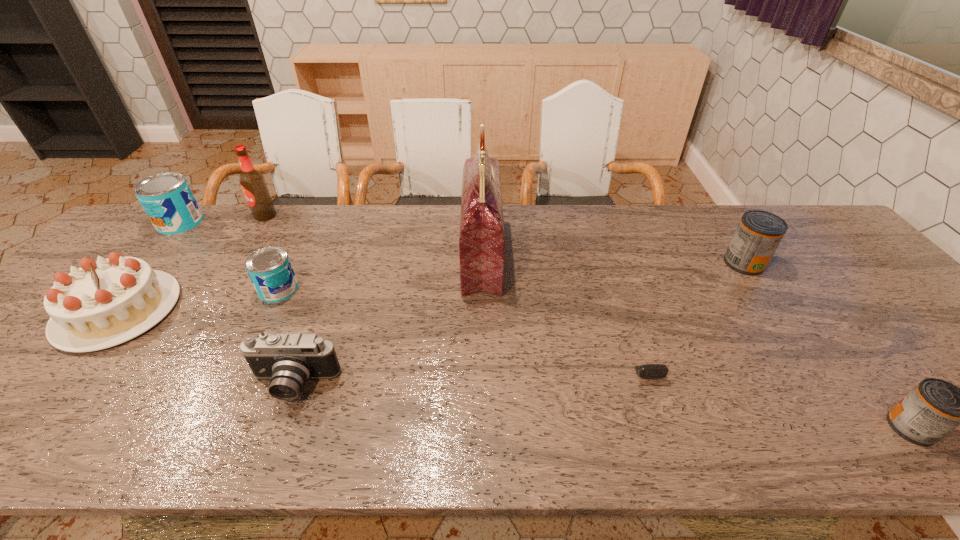
This screenshot has height=540, width=960. What are the coordinates of `free spot that satisfies the following two spatial constraints: 1. on the front-facing side of the webcam; 2. on the left side of the rightmost can` in the screenshot? It's located at (661, 427).

At what (x,y) coordinates should I click in order to perform the action: click on free space in the image that satisfies the following two spatial constraints: 1. on the front-facing side of the nearest can; 2. on the right side of the handbag. Please return your answer as a coordinate pair (x, y). Looking at the image, I should click on (482, 427).

You are a GUI agent. You are given a task and a screenshot of the screen. Output one action in this format:
    pyautogui.click(x=<x>, y=<y>)
    Task: Click on the free space that satisfies the following two spatial constraints: 1. on the front side of the third can from left to right; 2. on the right side of the nearer red can
    
    Given the screenshot: What is the action you would take?
    pyautogui.click(x=857, y=427)

Find the location of `vacant area in the image that satisfies the following two spatial constraints: 1. on the back side of the second farthest can; 2. on the left side of the birthday cake`. vacant area in the image that satisfies the following two spatial constraints: 1. on the back side of the second farthest can; 2. on the left side of the birthday cake is located at coordinates (157, 263).